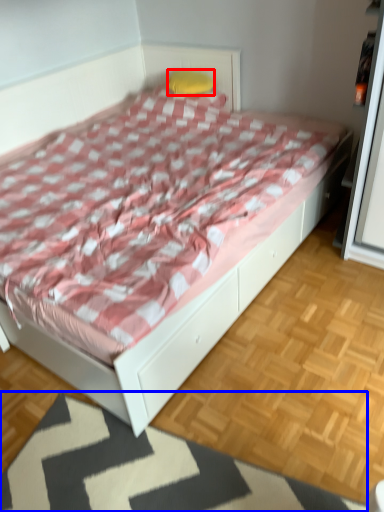
Question: Among these objects, which one is farthest to the camera, pillow (highlighted by a red box) or mat (highlighted by a blue box)?

Choices:
 (A) pillow
 (B) mat

Answer: (A)